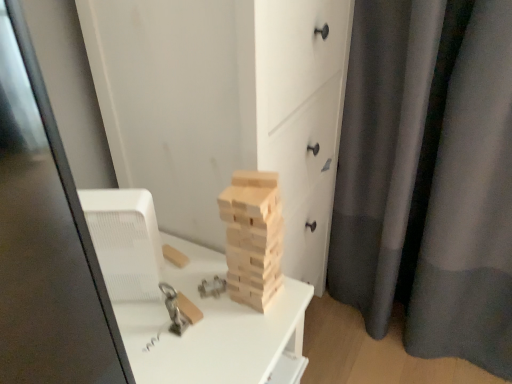
Question: Based on their positions, is wooden blocks at center located to the left or right of gray matte curtain at right?

Choices:
 (A) right
 (B) left

Answer: (B)

Question: Is point (190, 66) closer or farther from the camera than point (394, 92)?

Choices:
 (A) farther
 (B) closer

Answer: (B)

Question: Based on their relative distances, which object is nearer to the wooden blocks at center?

Choices:
 (A) natural wood blocks at center
 (B) gray matte curtain at right

Answer: (A)

Question: Considering the real-world distances, which object is closest to the natural wood blocks at center?

Choices:
 (A) gray matte curtain at right
 (B) wooden blocks at center

Answer: (B)